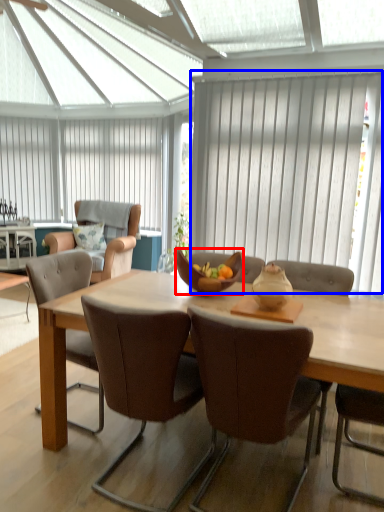
Question: Which point is further to the camera, bowl (highlighted by a red box) or curtain (highlighted by a blue box)?

Choices:
 (A) bowl
 (B) curtain

Answer: (B)